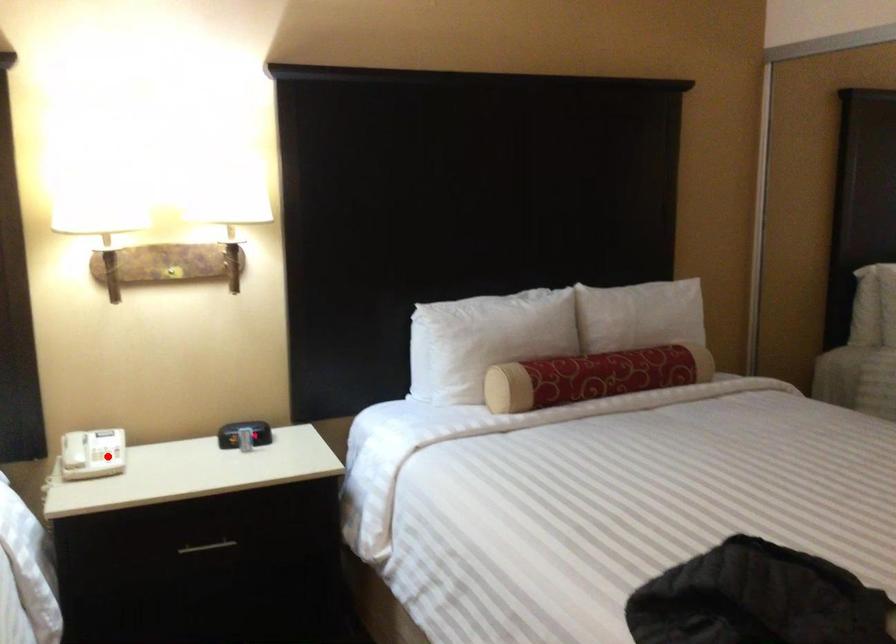
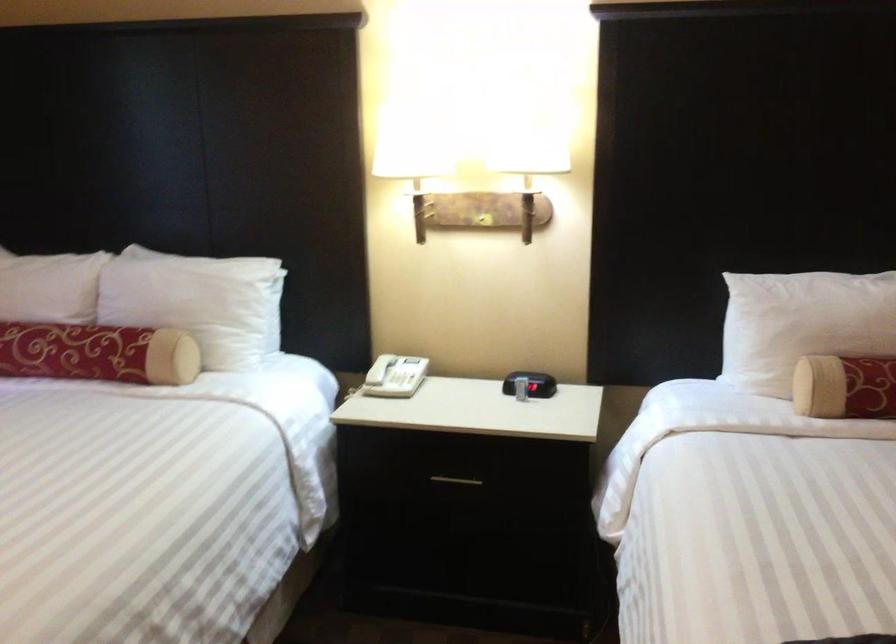
Question: I am providing you with two images of the same scene from different viewpoints. In image1, a red point is highlighted. Considering the same 3D point in image2, which of the following is correct?

Choices:
 (A) It is closer
 (B) It is farther

Answer: (B)